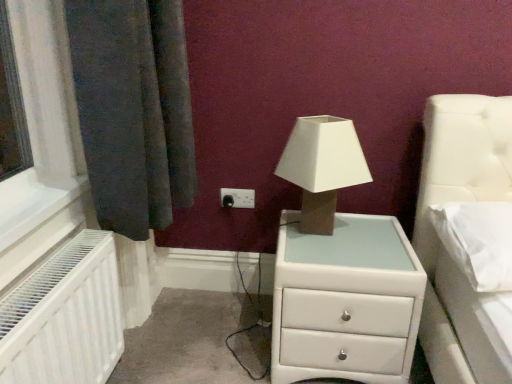
Question: From the image's perspective, relative to white plastic electric outlet at center, is white glossy chest of drawers at center above or below?

Choices:
 (A) below
 (B) above

Answer: (A)

Question: Is white glossy chest of drawers at center in front of or behind white plastic electric outlet at center in the image?

Choices:
 (A) front
 (B) behind

Answer: (A)

Question: Considering the real-world distances, which object is closest to the matte beige cardboard at center?

Choices:
 (A) white soft pillow at right
 (B) white glossy chest of drawers at center
 (C) white plastic electric outlet at center

Answer: (B)

Question: Considering the real-world distances, which object is closest to the white glossy chest of drawers at center?

Choices:
 (A) matte beige cardboard at center
 (B) white plastic electric outlet at center
 (C) white soft pillow at right

Answer: (A)